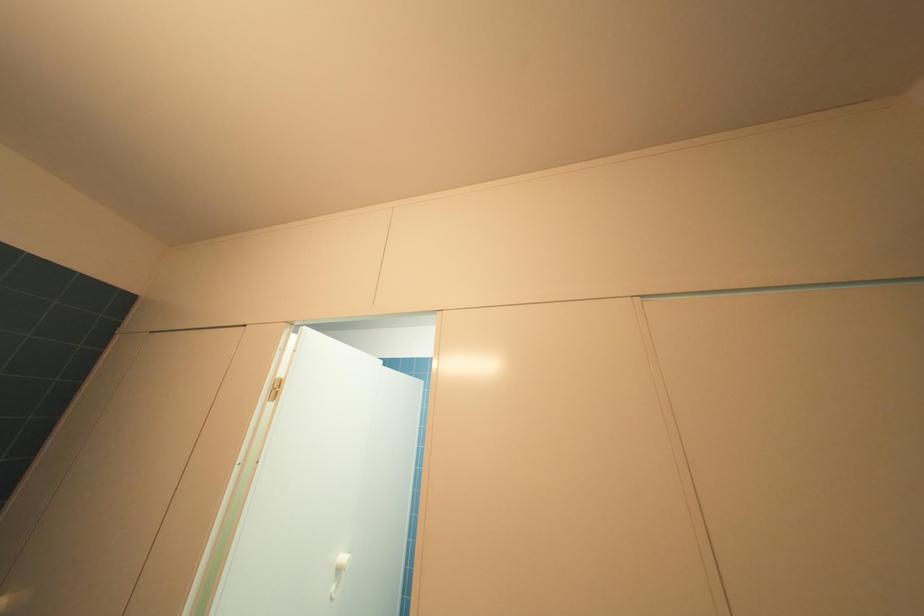
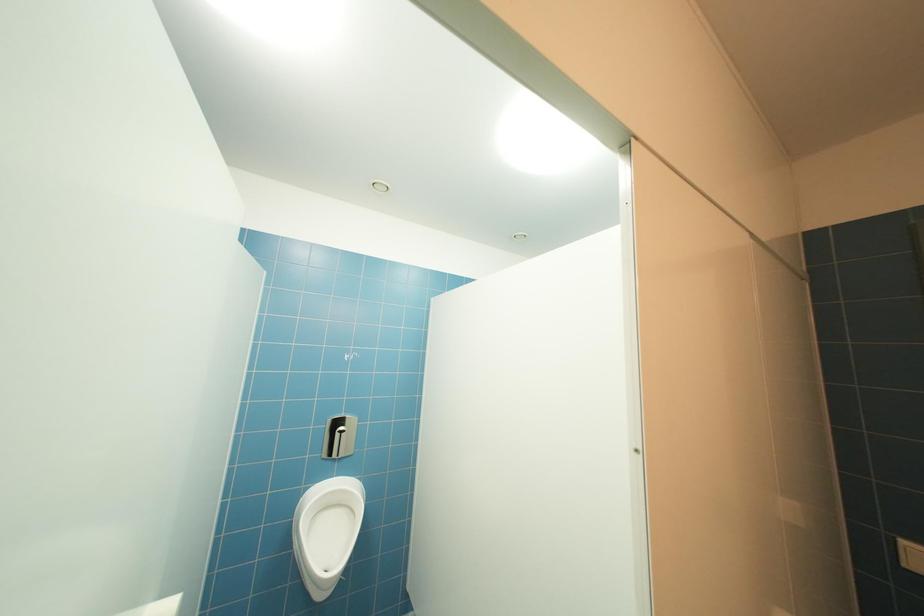
Question: Based on the continuous images, in which direction is the camera rotating? Reply with the corresponding letter.

Choices:
 (A) Left
 (B) Right
 (C) Up
 (D) Down

Answer: (B)